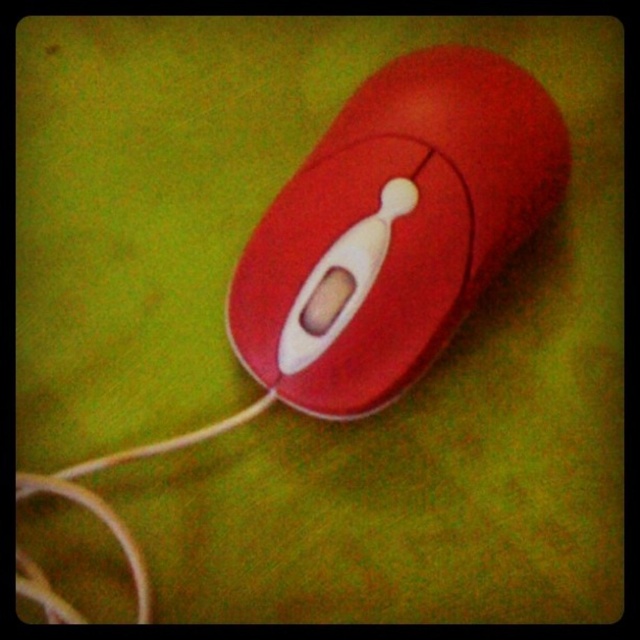
Can you confirm if matte plastic mouse at center is positioned to the left of white matte string at lower left?

Incorrect, matte plastic mouse at center is not on the left side of white matte string at lower left.

Is matte plastic mouse at center to the right of white matte string at lower left from the viewer's perspective?

Indeed, matte plastic mouse at center is positioned on the right side of white matte string at lower left.

Is point (364, 355) positioned before point (170, 442)?

No, it is behind (170, 442).

This screenshot has width=640, height=640. What are the coordinates of `matte plastic mouse at center` in the screenshot? It's located at (394, 228).